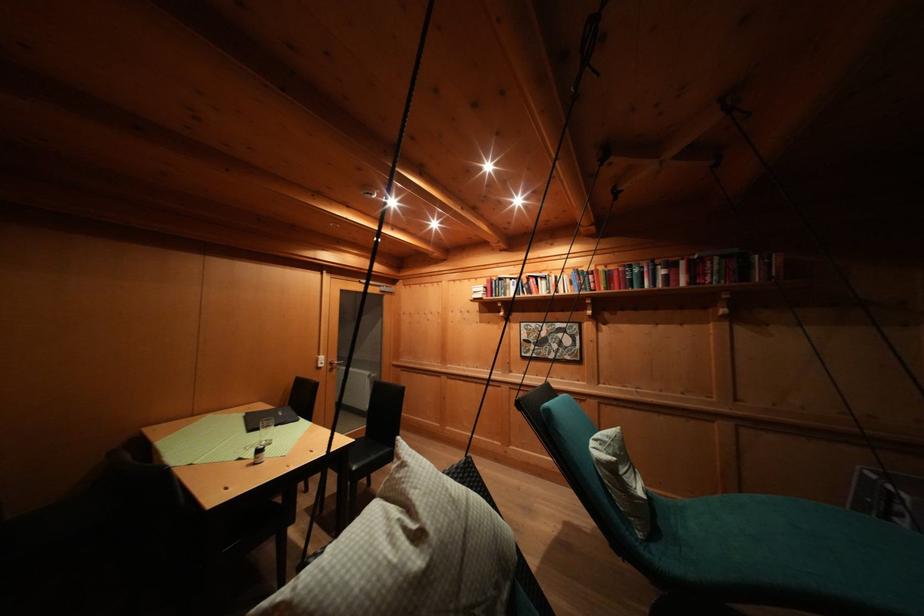
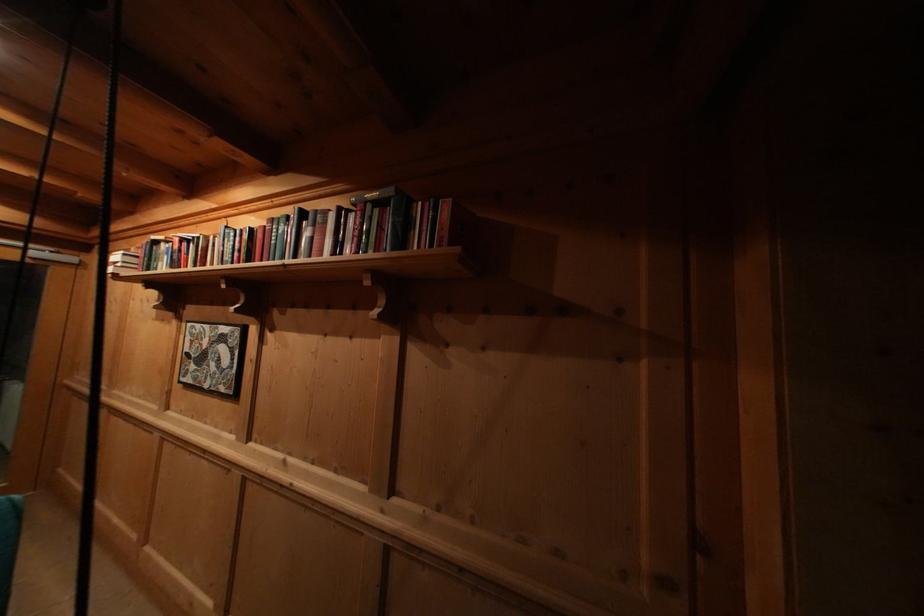
Find the pixel in the second image that matches (535,282) in the first image.

(188, 246)